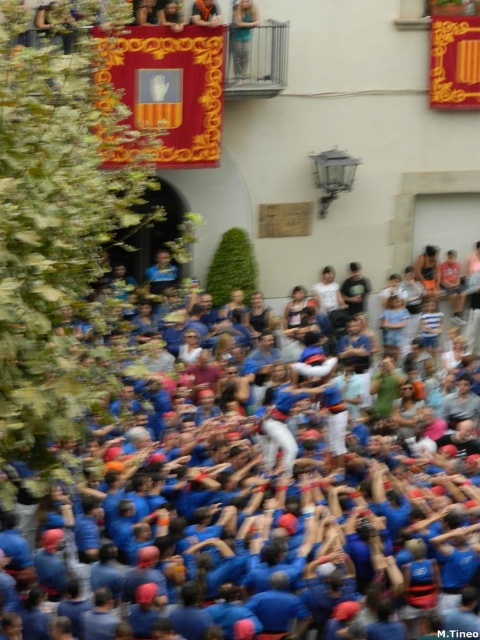
Question: Which of the following is the farthest from the observer?

Choices:
 (A) (245, 44)
 (B) (264, 394)

Answer: (A)

Question: Does blue fabric crowd at center have a greater width compared to light blue denim jeans at upper center?

Choices:
 (A) no
 (B) yes

Answer: (B)

Question: Can you confirm if blue fabric crowd at center is positioned to the right of light blue denim jeans at upper center?

Choices:
 (A) no
 (B) yes

Answer: (B)

Question: Which of the following is the farthest from the observer?

Choices:
 (A) light blue denim jeans at upper center
 (B) blue fabric crowd at center

Answer: (A)

Question: Is blue fabric crowd at center to the right of light blue denim jeans at upper center from the viewer's perspective?

Choices:
 (A) yes
 (B) no

Answer: (A)